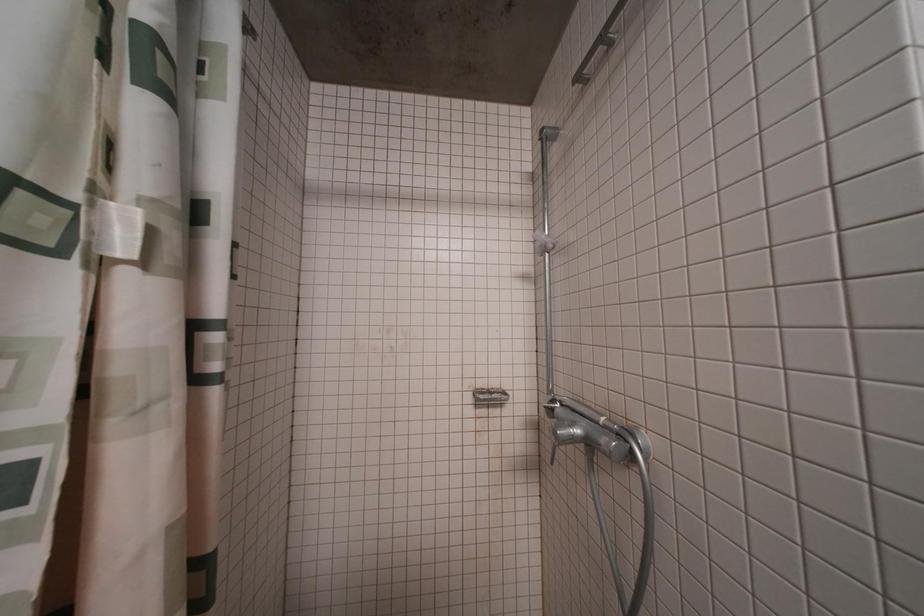
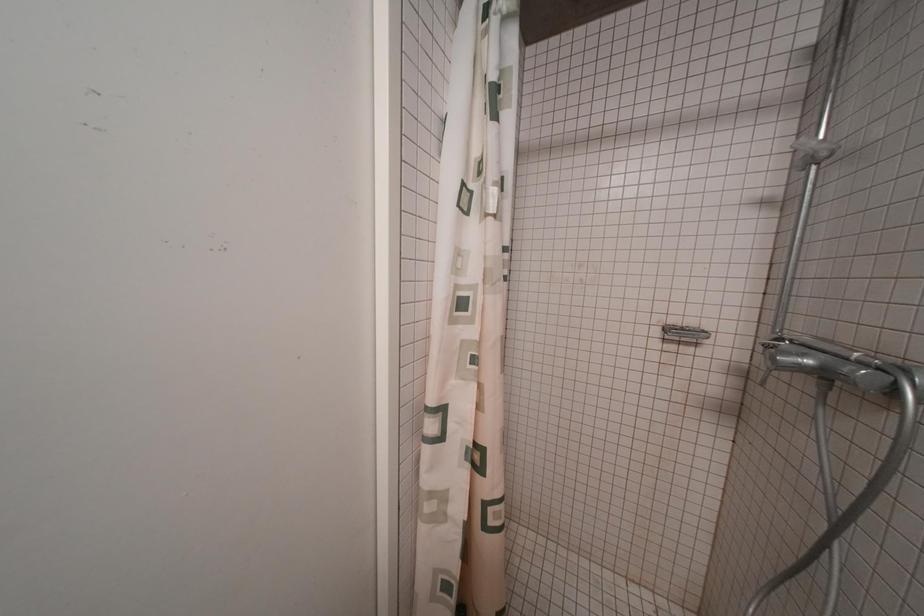
Question: The camera is either moving clockwise (left) or counter-clockwise (right) around the object. The first image is from the beginning of the video and the second image is from the end. Is the camera moving left or right when shooting the video?

Choices:
 (A) Left
 (B) Right

Answer: (B)